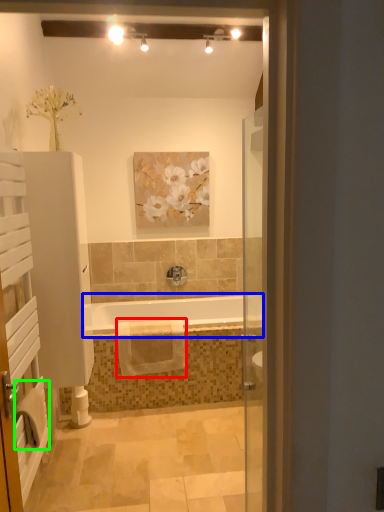
Question: Considering the real-world distances, which object is farthest from bath towel (highlighted by a red box)? bathtub (highlighted by a blue box) or bath towel (highlighted by a green box)?

Choices:
 (A) bathtub
 (B) bath towel

Answer: (B)